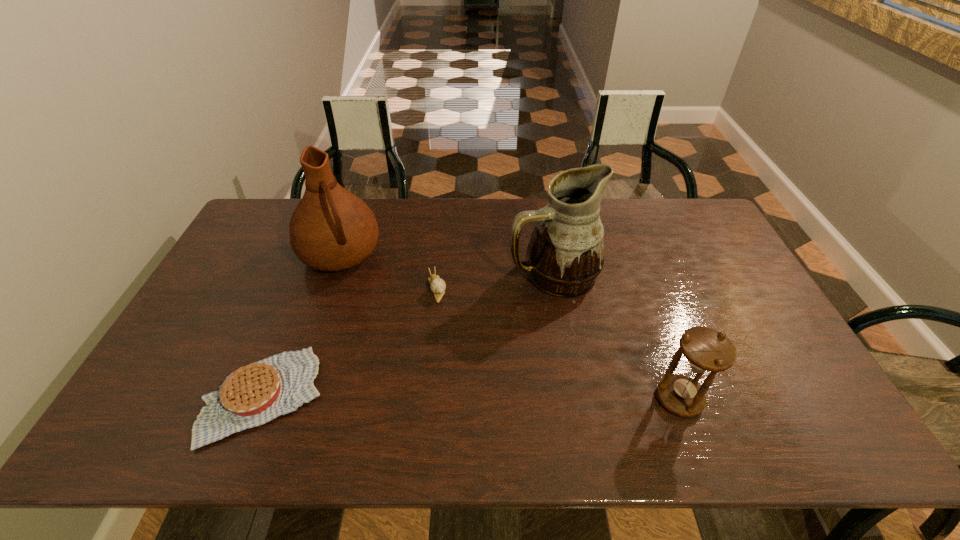
I want to click on free space that satisfies the following two spatial constraints: 1. on the front side of the left pitcher; 2. on the right side of the third shortest object, so click(x=292, y=399).

In order to click on blank area in the image that satisfies the following two spatial constraints: 1. on the back side of the fourth object from left to right; 2. on the left side of the third object from left to right in this screenshot , I will do `click(439, 274)`.